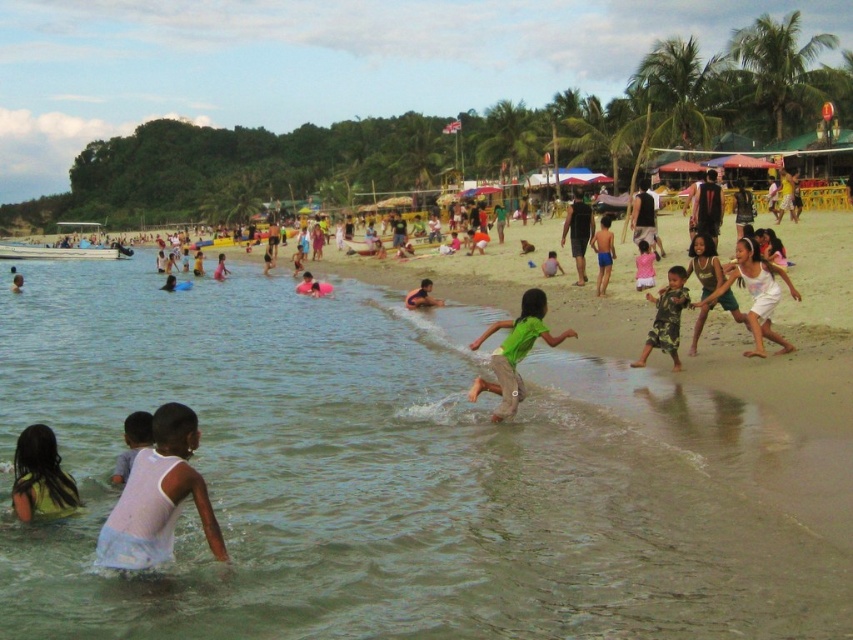
Who is positioned more to the right, clear water at beach center or pink fabric dress at center?

pink fabric dress at center is more to the right.

The image size is (853, 640). Identify the location of clear water at beach center. (387, 476).

The height and width of the screenshot is (640, 853). Find the location of `clear water at beach center`. clear water at beach center is located at coordinates (387, 476).

Is camouflage shorts at lower right behind blue swim trunks at center?

No.

Who is more distant from viewer, (648, 353) or (604, 250)?

The point (604, 250) is behind.

Is point (648, 333) in front of point (606, 276)?

Yes, point (648, 333) is closer to viewer.

The width and height of the screenshot is (853, 640). I want to click on camouflage shorts at lower right, so click(x=666, y=317).

Who is higher up, clear water at beach center or white cotton tank top at lower left?

Positioned higher is clear water at beach center.

Is point (560, 460) farther from camera compared to point (143, 493)?

Yes, it is behind point (143, 493).

At what (x,y) coordinates should I click in order to perform the action: click on clear water at beach center. Please return your answer as a coordinate pair (x, y). Looking at the image, I should click on (387, 476).